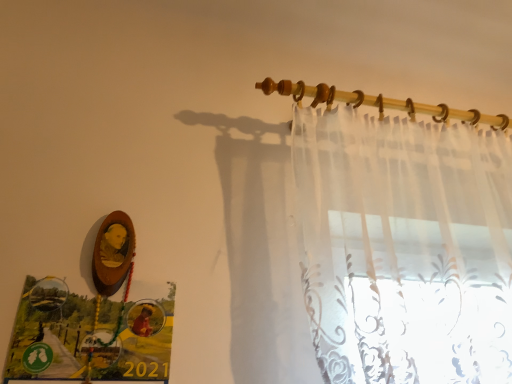
Question: Does translucent fabric at upper center have a greater height compared to sheer white curtain at upper right?

Choices:
 (A) yes
 (B) no

Answer: (B)

Question: Is translucent fabric at upper center far from sheer white curtain at upper right?

Choices:
 (A) yes
 (B) no

Answer: (B)

Question: Is sheer white curtain at upper right inside translucent fabric at upper center?

Choices:
 (A) yes
 (B) no

Answer: (B)

Question: Is translucent fabric at upper center touching sheer white curtain at upper right?

Choices:
 (A) no
 (B) yes

Answer: (A)

Question: Can you confirm if translucent fabric at upper center is positioned to the left of sheer white curtain at upper right?

Choices:
 (A) yes
 (B) no

Answer: (A)

Question: From the image's perspective, is translucent fabric at upper center beneath sheer white curtain at upper right?

Choices:
 (A) yes
 (B) no

Answer: (B)

Question: Considering the relative positions of sheer white curtain at upper right and translucent fabric at upper center in the image provided, is sheer white curtain at upper right to the left of translucent fabric at upper center from the viewer's perspective?

Choices:
 (A) yes
 (B) no

Answer: (B)

Question: Does sheer white curtain at upper right have a smaller size compared to translucent fabric at upper center?

Choices:
 (A) yes
 (B) no

Answer: (B)

Question: From a real-world perspective, is sheer white curtain at upper right positioned over translucent fabric at upper center based on gravity?

Choices:
 (A) yes
 (B) no

Answer: (B)

Question: Does sheer white curtain at upper right come behind translucent fabric at upper center?

Choices:
 (A) no
 (B) yes

Answer: (A)

Question: Is sheer white curtain at upper right located outside translucent fabric at upper center?

Choices:
 (A) yes
 (B) no

Answer: (A)

Question: Is sheer white curtain at upper right at the right side of translucent fabric at upper center?

Choices:
 (A) no
 (B) yes

Answer: (B)

Question: Is point (434, 114) closer or farther from the camera than point (478, 339)?

Choices:
 (A) closer
 (B) farther

Answer: (B)